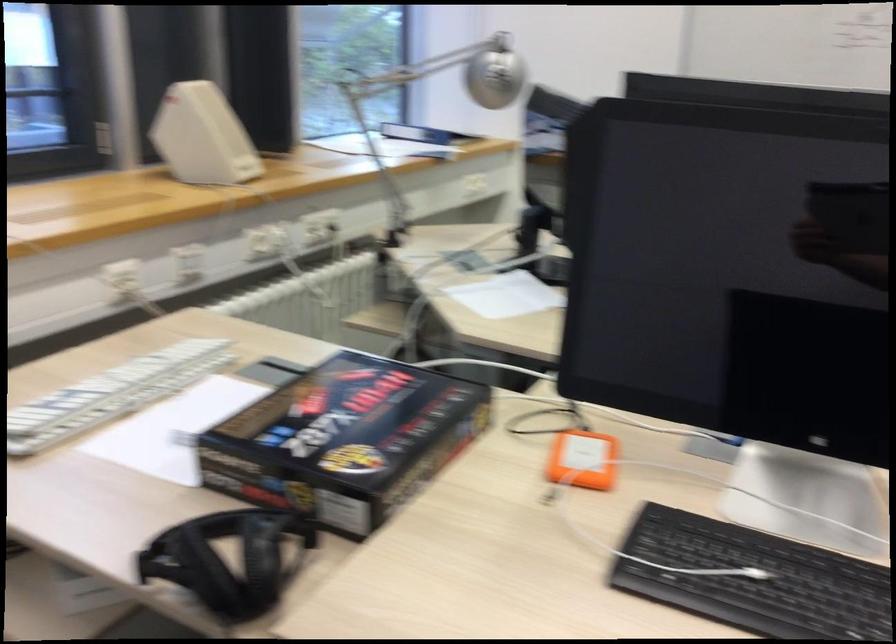
I want to click on silver desk lamp head, so click(392, 113).